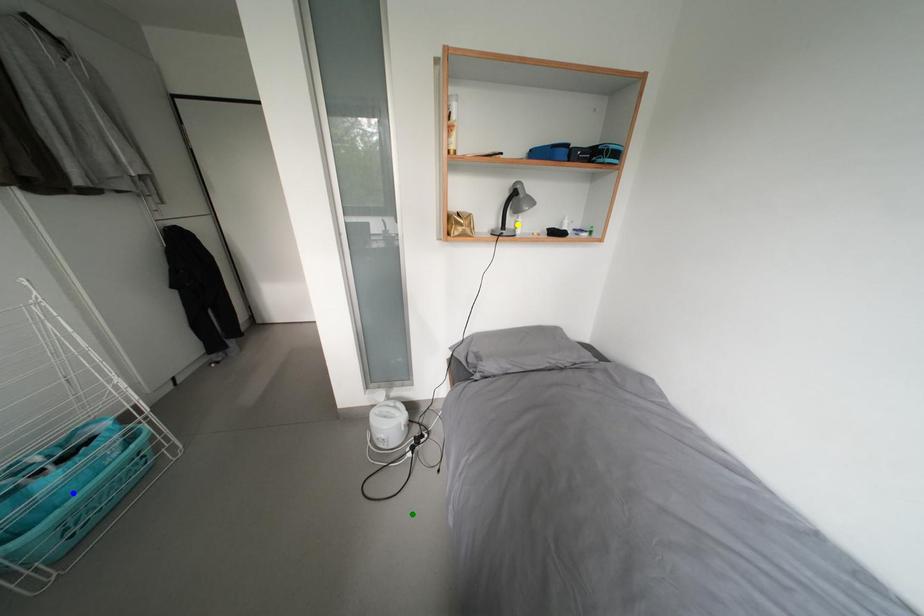
Order these from nearest to farthest:
A) green point
B) yellow point
C) blue point

blue point, yellow point, green point